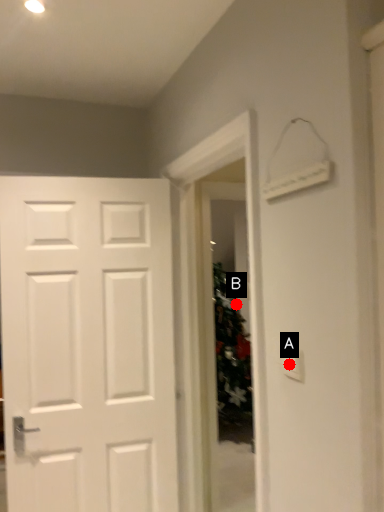
Question: Two points are circled on the image, labeled by A and B beside each circle. Which point is farther to the camera?

Choices:
 (A) A is further
 (B) B is further

Answer: (B)